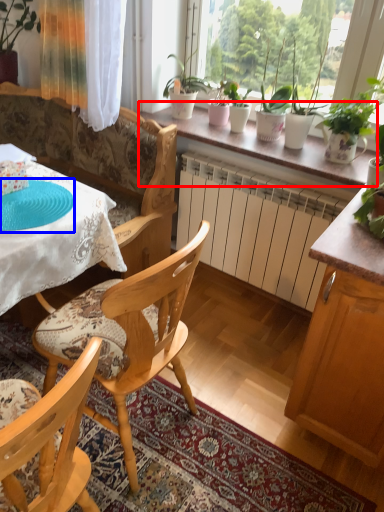
Question: Which point is further to the camera, window sill (highlighted by a red box) or paper plate (highlighted by a blue box)?

Choices:
 (A) window sill
 (B) paper plate

Answer: (A)